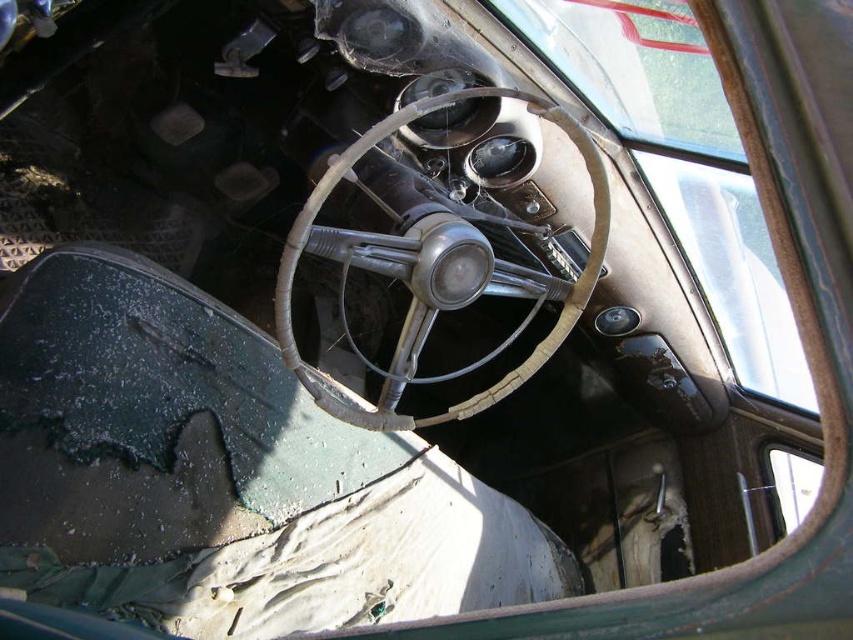
Is transparent glass window at upper center closer to the viewer compared to leather/wooden steering wheel at center?

No, transparent glass window at upper center is behind leather/wooden steering wheel at center.

Can you confirm if transparent glass window at upper center is positioned to the right of leather/wooden steering wheel at center?

Indeed, transparent glass window at upper center is positioned on the right side of leather/wooden steering wheel at center.

Does point (744, 227) lie behind point (605, 237)?

Yes, point (744, 227) is behind point (605, 237).

The image size is (853, 640). Find the location of `transparent glass window at upper center`. transparent glass window at upper center is located at coordinates (680, 163).